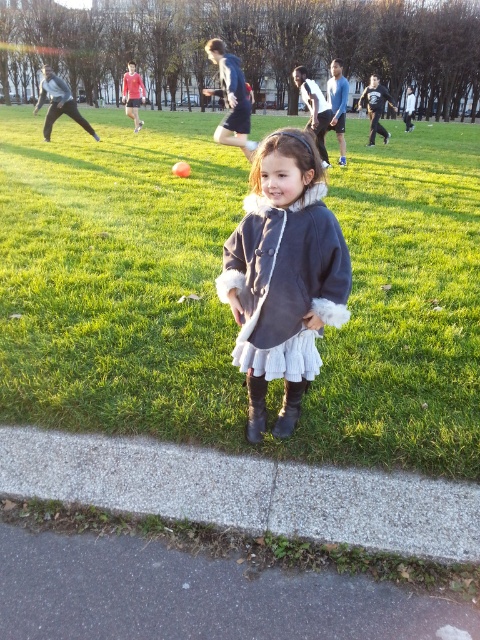
You are a photographer trying to capture the girl in the park. You notice the matte gray coat at center and the brown suede boot at lower center. Which object would be closer to the camera in your photo?

The matte gray coat at center is in front of the brown suede boot at lower center, so the matte gray coat at center would be closer to the camera in the photo.